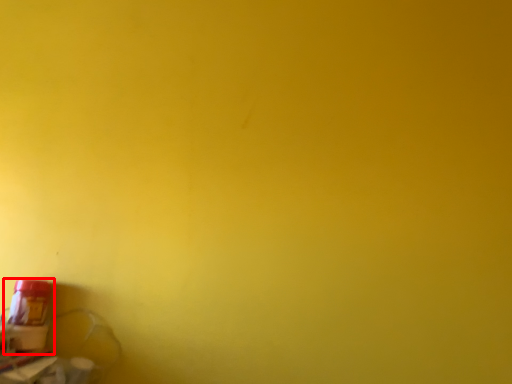
Question: From the image, what is the correct spatial relationship of bottle (annotated by the red box) in relation to window sill?

Choices:
 (A) right
 (B) left

Answer: (A)